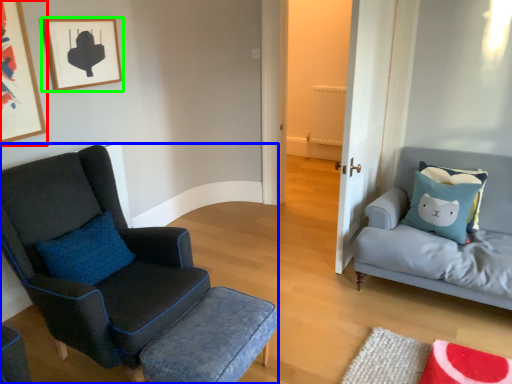
Question: Estimate the real-world distances between objects in this image. Which object is closer to picture frame (highlighted by a red box), chair (highlighted by a blue box) or picture frame (highlighted by a green box)?

Choices:
 (A) chair
 (B) picture frame

Answer: (B)